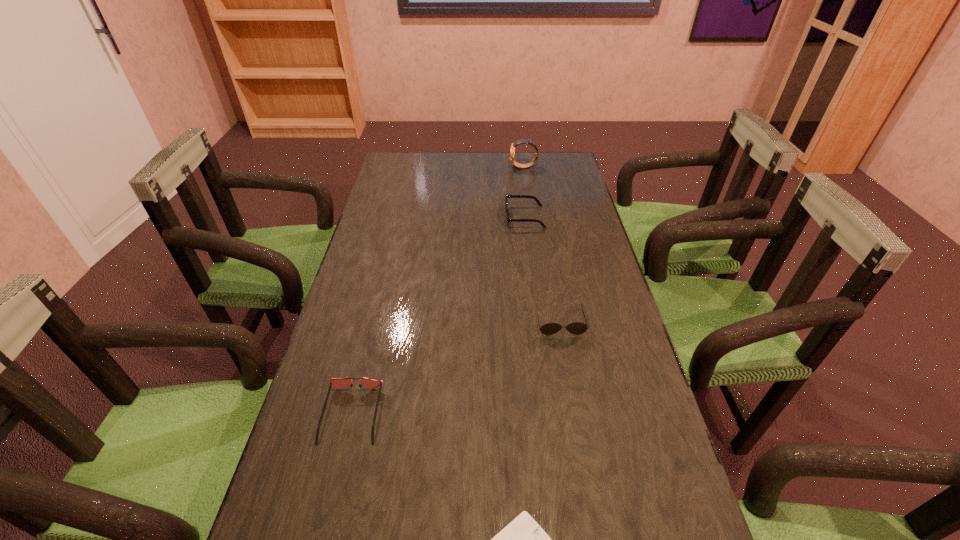
Image resolution: width=960 pixels, height=540 pixels. What are the coordinates of `blank area located on the front-facing side of the farthest sunglasses` in the screenshot? It's located at (456, 217).

You are a GUI agent. You are given a task and a screenshot of the screen. Output one action in this format:
    pyautogui.click(x=<x>, y=<y>)
    Task: Click on the vacant space located on the front-facing side of the farthest sunglasses
    
    Given the screenshot: What is the action you would take?
    pyautogui.click(x=433, y=217)

The image size is (960, 540). I want to click on vacant space located on the front-facing side of the second farthest sunglasses, so click(569, 375).

Locate an element on the screen. The width and height of the screenshot is (960, 540). vacant space located 0.160m on the bridge of the nearest sunglasses is located at coordinates [324, 530].

At what (x,y) coordinates should I click in order to perform the action: click on object that is at the far edge. Please return your answer as a coordinate pair (x, y). This screenshot has width=960, height=540. Looking at the image, I should click on click(x=522, y=141).

Locate an element on the screen. This screenshot has height=540, width=960. object that is at the left edge is located at coordinates (372, 383).

The width and height of the screenshot is (960, 540). In order to click on watch that is at the right edge in this screenshot , I will do `click(522, 141)`.

Where is `object positioned at the far right corner`? The height and width of the screenshot is (540, 960). object positioned at the far right corner is located at coordinates (522, 141).

Where is `vacant space at the far edge`? The height and width of the screenshot is (540, 960). vacant space at the far edge is located at coordinates (484, 170).

You are a GUI agent. You are given a task and a screenshot of the screen. Output one action in this format:
    pyautogui.click(x=<x>, y=<y>)
    Task: Click on the blank area at the left edge
    Image resolution: width=960 pixels, height=540 pixels.
    Given the screenshot: What is the action you would take?
    pyautogui.click(x=330, y=416)